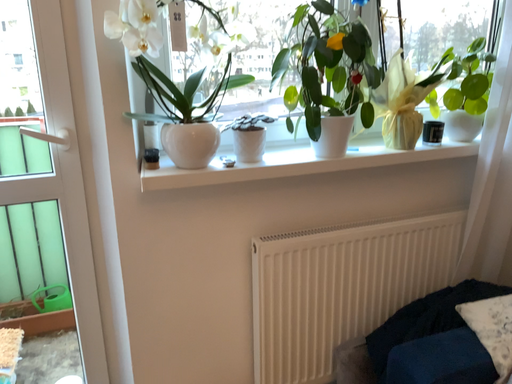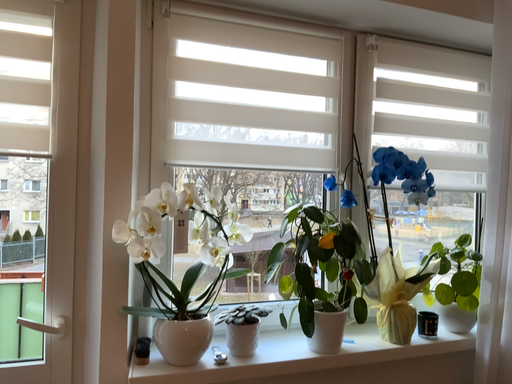
Question: Which way did the camera rotate in the video?

Choices:
 (A) rotated upward
 (B) rotated downward

Answer: (A)